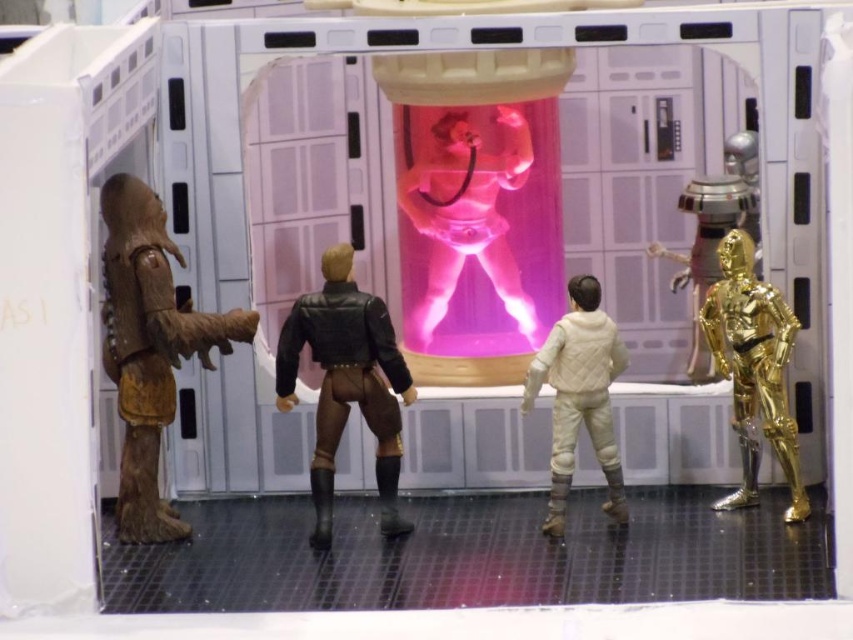
You are an astronaut in this spacecraft. You need to reach the control panel located behind the gold metallic robot at right and the white quilted jacket at center. Considering their heights, which object might block your view more when you try to look past them?

The gold metallic robot at right is much taller than the white quilted jacket at center, so it would block your view more when trying to look past them.

You are an astronaut inside this spacecraft and need to retrieve an object from the pink translucent figure at center and the leather jacket at center. Which object can you reach without moving closer to the central cylinder?

The pink translucent figure at center is closer to you, so you can reach the object on it without moving closer. The leather jacket at center is further away, requiring you to move closer to access it.